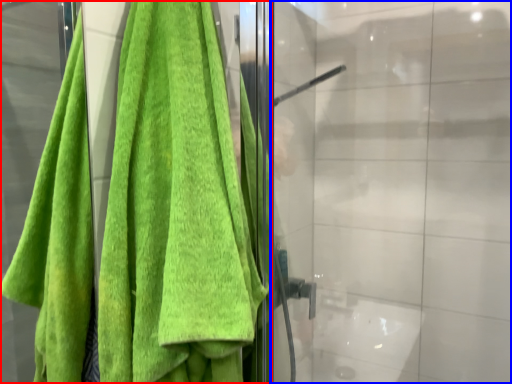
Question: Which object is closer to the camera taking this photo, towel (highlighted by a red box) or glass door (highlighted by a blue box)?

Choices:
 (A) towel
 (B) glass door

Answer: (A)